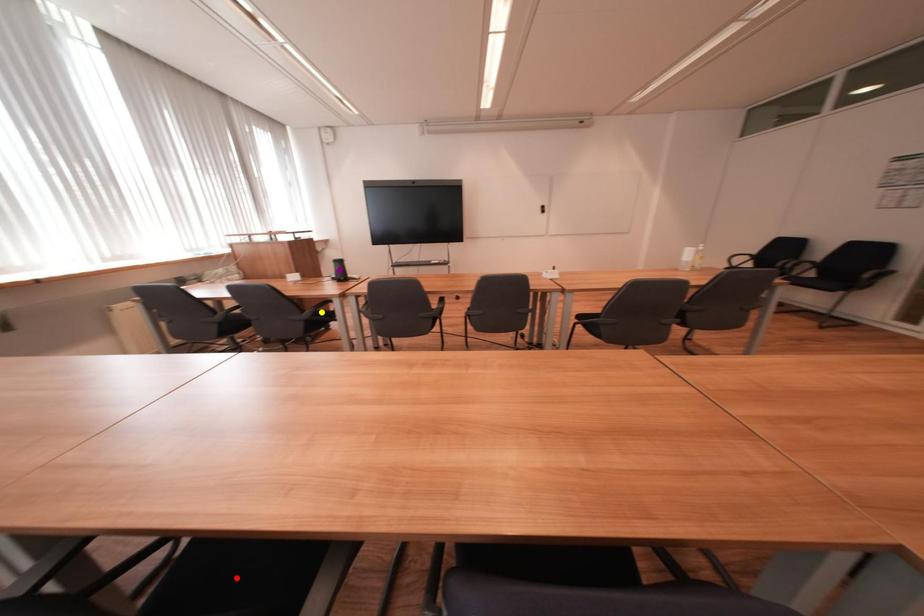
Order these from nearest to farthest:
yellow point, purple point, red point

purple point, yellow point, red point